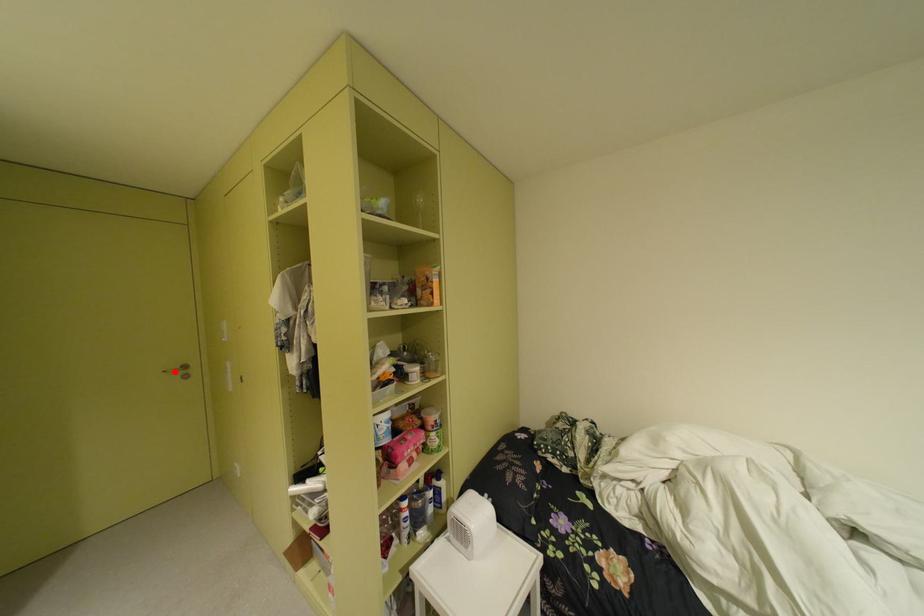
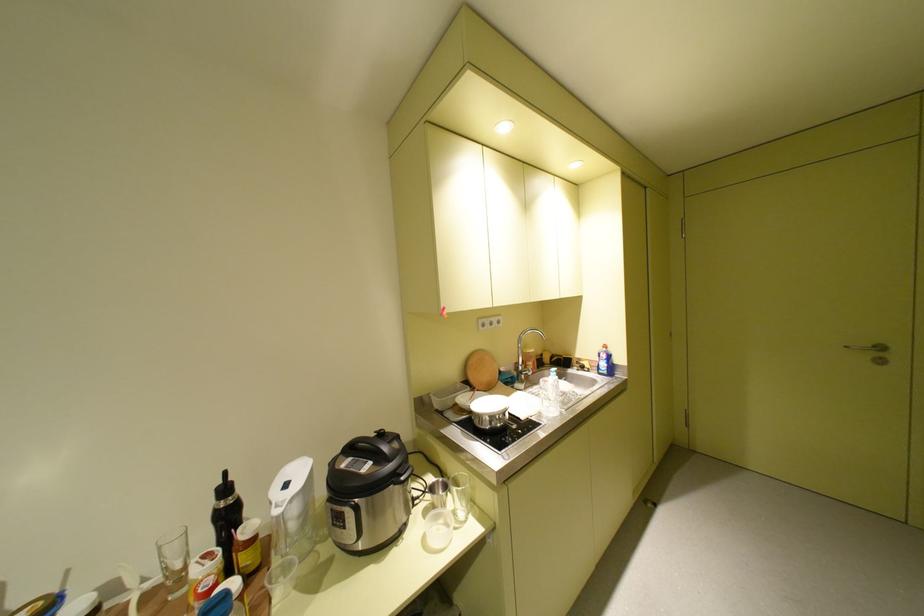
In the second image, find the point that corresponds to the highlighted location in the first image.

(857, 347)